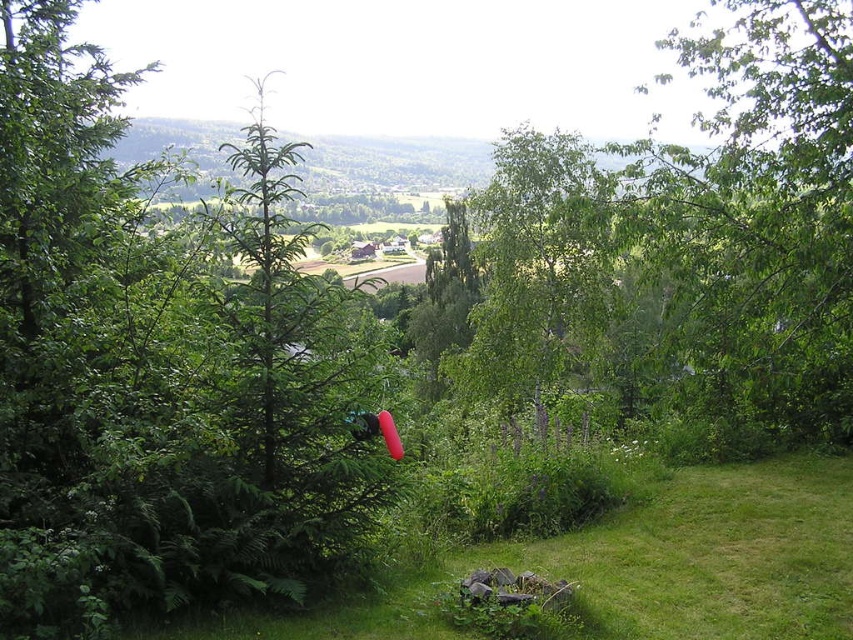
Does green leafy tree at left come behind green grass at lower left?

No, green leafy tree at left is closer to the viewer.

Can you confirm if green leafy tree at left is wider than green grass at lower left?

Yes.

The width and height of the screenshot is (853, 640). Identify the location of green leafy tree at left. (164, 365).

Where is `green leafy tree at left`? Image resolution: width=853 pixels, height=640 pixels. green leafy tree at left is located at coordinates (164, 365).

Is point (718, 381) positioned in front of point (808, 568)?

No, (718, 381) is behind (808, 568).

Does point (573, 202) come farther from viewer compared to point (679, 595)?

Yes.

Between point (839, 172) and point (704, 500), which one is positioned in front?

Positioned in front is point (704, 500).

The image size is (853, 640). Find the location of `green leafy tree at center`. green leafy tree at center is located at coordinates (749, 227).

Does green leafy tree at left have a greater width compared to green leafy tree at center?

Yes.

Describe the element at coordinates (164, 365) in the screenshot. I see `green leafy tree at left` at that location.

Measure the distance between point [317,445] and camera.

Point [317,445] is 6.36 meters away from camera.

I want to click on green leafy tree at left, so click(164, 365).